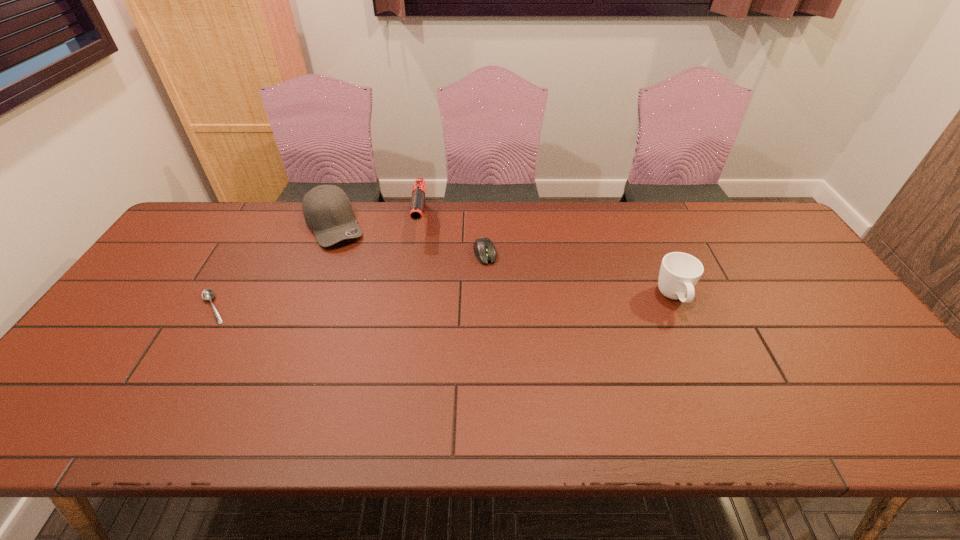
This screenshot has height=540, width=960. In order to click on the shortest object in this screenshot , I will do [x=208, y=294].

I want to click on the leftmost object, so click(208, 294).

You are a GUI agent. You are given a task and a screenshot of the screen. Output one action in this format:
    pyautogui.click(x=<x>, y=<y>)
    Task: Click on the third shortest object
    
    Given the screenshot: What is the action you would take?
    pyautogui.click(x=679, y=273)

I want to click on the rightmost object, so click(679, 273).

Identify the location of gun. (418, 202).

Where is `computer mouse`? The width and height of the screenshot is (960, 540). computer mouse is located at coordinates (484, 249).

At what (x,y) coordinates should I click in order to perform the action: click on the second object from right to left. Please return your answer as a coordinate pair (x, y). Looking at the image, I should click on (484, 249).

You are a GUI agent. You are given a task and a screenshot of the screen. Output one action in this format:
    pyautogui.click(x=<x>, y=<y>)
    Task: Click on the baseball cap
    This screenshot has height=540, width=960.
    Given the screenshot: What is the action you would take?
    327,210

Find the location of a particular element. The image size is (960, 540). free region located on the right of the soupspoon is located at coordinates (372, 308).

This screenshot has width=960, height=540. Identify the location of vacant area situated with the handle on the side of the third shortest object. (717, 399).